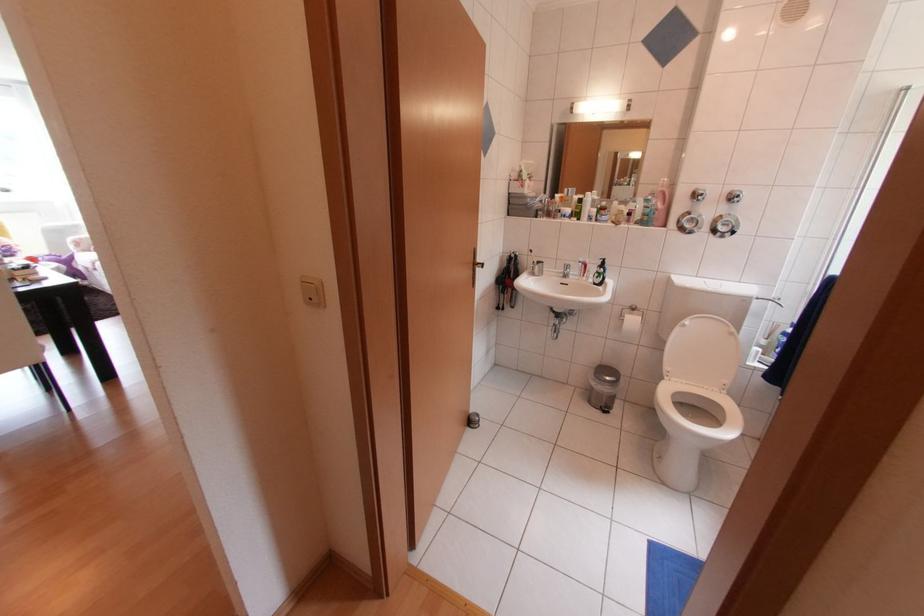
The image size is (924, 616). Find the location of `toilet flush handle`. toilet flush handle is located at coordinates (769, 300).